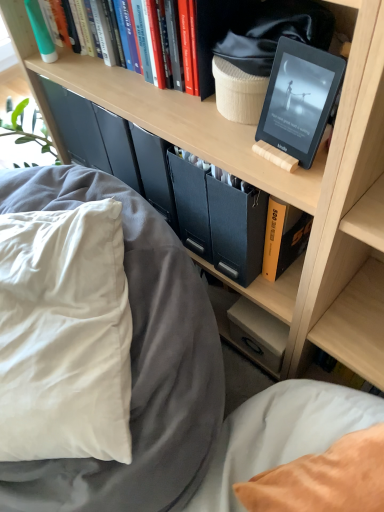
Question: Which direction should I rotate to look at yellow hardcover book at center, the fourth book positioned from the left?

Choices:
 (A) right
 (B) left

Answer: (A)

Question: Can you confirm if black matte tablet at upper right is thinner than green matte toothpaste tube at upper left, marked as the first book in a left-to-right arrangement?

Choices:
 (A) no
 (B) yes

Answer: (A)

Question: Does black matte tablet at upper right have a smaller size compared to green matte toothpaste tube at upper left, acting as the fourth book starting from the right?

Choices:
 (A) no
 (B) yes

Answer: (A)

Question: Is black matte tablet at upper right at the right side of green matte toothpaste tube at upper left, which is the 2th book in top-to-bottom order?

Choices:
 (A) no
 (B) yes

Answer: (B)

Question: Is green matte toothpaste tube at upper left, acting as the fourth book starting from the right, completely or partially inside black matte tablet at upper right?

Choices:
 (A) no
 (B) yes

Answer: (A)

Question: From a real-world perspective, is black matte tablet at upper right positioned over green matte toothpaste tube at upper left, which is the 3th book in bottom-to-top order, based on gravity?

Choices:
 (A) no
 (B) yes

Answer: (B)

Question: Is black matte tablet at upper right oriented away from green matte toothpaste tube at upper left, which is the 3th book in bottom-to-top order?

Choices:
 (A) no
 (B) yes

Answer: (A)

Question: From the image's perspective, would you say green matte toothpaste tube at upper left, marked as the first book in a left-to-right arrangement, is positioned over yellow hardcover book at center, which ranks as the 1th book in bottom-to-top order?

Choices:
 (A) no
 (B) yes

Answer: (B)

Question: Is the position of green matte toothpaste tube at upper left, acting as the fourth book starting from the right, more distant than that of yellow hardcover book at center, the fourth book positioned from the left?

Choices:
 (A) yes
 (B) no

Answer: (A)

Question: From a real-world perspective, does green matte toothpaste tube at upper left, which is the 2th book in top-to-bottom order, sit lower than yellow hardcover book at center, the fourth book in the top-to-bottom sequence?

Choices:
 (A) yes
 (B) no

Answer: (B)

Question: From the image's perspective, does green matte toothpaste tube at upper left, marked as the first book in a left-to-right arrangement, appear lower than yellow hardcover book at center, the fourth book in the top-to-bottom sequence?

Choices:
 (A) no
 (B) yes

Answer: (A)

Question: Does green matte toothpaste tube at upper left, which is the 2th book in top-to-bottom order, have a lesser height compared to yellow hardcover book at center, the fourth book positioned from the left?

Choices:
 (A) yes
 (B) no

Answer: (A)

Question: Considering the relative sizes of green matte toothpaste tube at upper left, acting as the fourth book starting from the right, and yellow hardcover book at center, the fourth book positioned from the left, in the image provided, is green matte toothpaste tube at upper left, acting as the fourth book starting from the right, wider than yellow hardcover book at center, the fourth book positioned from the left,?

Choices:
 (A) yes
 (B) no

Answer: (B)

Question: Considering the relative sizes of hardcover books at upper center, which is the 4th book from bottom to top, and black matte tablet at upper right in the image provided, is hardcover books at upper center, which is the 4th book from bottom to top, taller than black matte tablet at upper right?

Choices:
 (A) no
 (B) yes

Answer: (B)